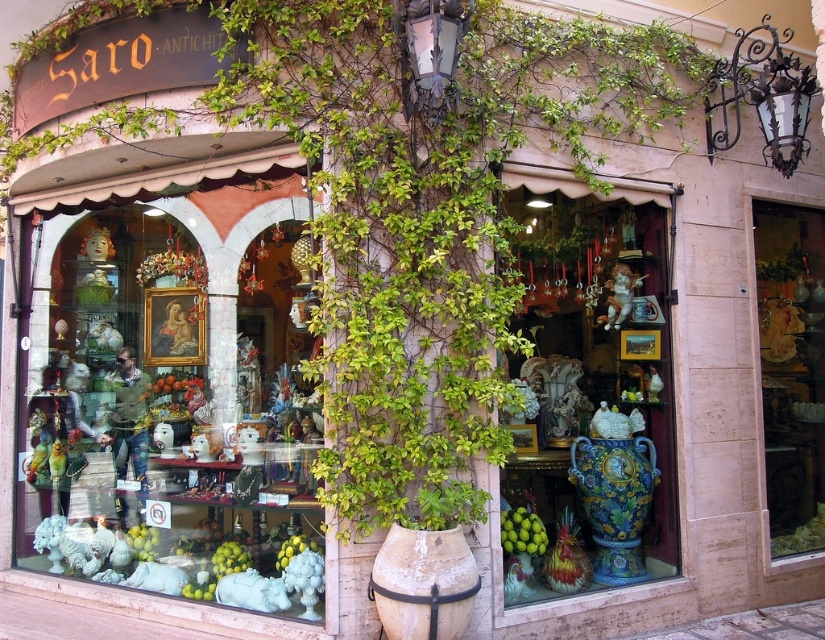
In the scene shown: You are an antique collector who wants to display both the matte white statue at center and the black wrought iron lamp at upper right on a shelf. The shelf has a maximum width capacity of 1 meter. If the combined width of both items is 0.8 meters, will they fit together on the shelf?

The combined width of the matte white statue at center and the black wrought iron lamp at upper right is 0.8 meters, which is less than the shelf capacity of 1 meter. Therefore, they will fit together on the shelf.

From the picture: You are a customer standing in front of the shop window. You see the matte white statue at center and the blue ceramic vase at center. Which object is positioned closer to you?

The matte white statue at center is closer to the viewer than the blue ceramic vase at center.